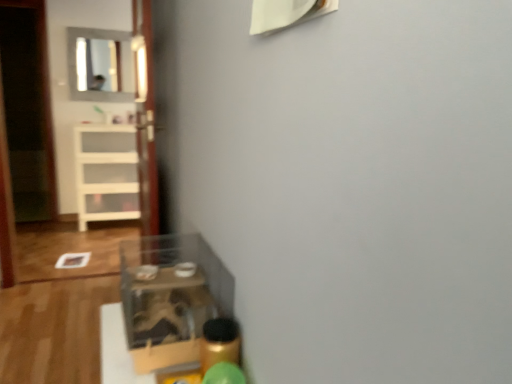
Question: Considering the relative sizes of transparent glass door at center and matte glass mirror at upper left in the image provided, is transparent glass door at center thinner than matte glass mirror at upper left?

Choices:
 (A) yes
 (B) no

Answer: (B)

Question: Is transparent glass door at center further to the viewer compared to matte glass mirror at upper left?

Choices:
 (A) no
 (B) yes

Answer: (A)

Question: From a real-world perspective, does transparent glass door at center sit lower than matte glass mirror at upper left?

Choices:
 (A) yes
 (B) no

Answer: (A)

Question: Does transparent glass door at center have a smaller size compared to matte glass mirror at upper left?

Choices:
 (A) no
 (B) yes

Answer: (A)

Question: Can you confirm if transparent glass door at center is shorter than matte glass mirror at upper left?

Choices:
 (A) no
 (B) yes

Answer: (A)

Question: Is matte glass mirror at upper left bigger or smaller than white glossy shelf at left, arranged as the second shelf when viewed from the front?

Choices:
 (A) big
 (B) small

Answer: (B)

Question: From the image's perspective, relative to white glossy shelf at left, placed as the first shelf when sorted from back to front, is matte glass mirror at upper left above or below?

Choices:
 (A) above
 (B) below

Answer: (A)

Question: In terms of width, does matte glass mirror at upper left look wider or thinner when compared to white glossy shelf at left, which is the 2th shelf in bottom-to-top order?

Choices:
 (A) thin
 (B) wide

Answer: (A)

Question: Is matte glass mirror at upper left spatially inside white glossy shelf at left, the 1th shelf positioned from the top, or outside of it?

Choices:
 (A) inside
 (B) outside

Answer: (B)

Question: From the image's perspective, is white glossy shelf at left, positioned as the first shelf in left-to-right order, positioned above or below transparent glass door at center?

Choices:
 (A) below
 (B) above

Answer: (A)

Question: Is white glossy shelf at left, the second shelf when ordered from right to left, inside the boundaries of transparent glass door at center, or outside?

Choices:
 (A) inside
 (B) outside

Answer: (B)

Question: From their relative heights in the image, would you say white glossy shelf at left, the second shelf when ordered from right to left, is taller or shorter than transparent glass door at center?

Choices:
 (A) short
 (B) tall

Answer: (A)

Question: Looking at the image, does white glossy shelf at left, arranged as the second shelf when viewed from the front, seem bigger or smaller compared to transparent glass door at center?

Choices:
 (A) big
 (B) small

Answer: (A)

Question: Visually, is transparent glass door at center positioned to the left or to the right of matte glass mirror at upper left?

Choices:
 (A) left
 (B) right

Answer: (B)

Question: In terms of size, does transparent glass door at center appear bigger or smaller than matte glass mirror at upper left?

Choices:
 (A) small
 (B) big

Answer: (B)